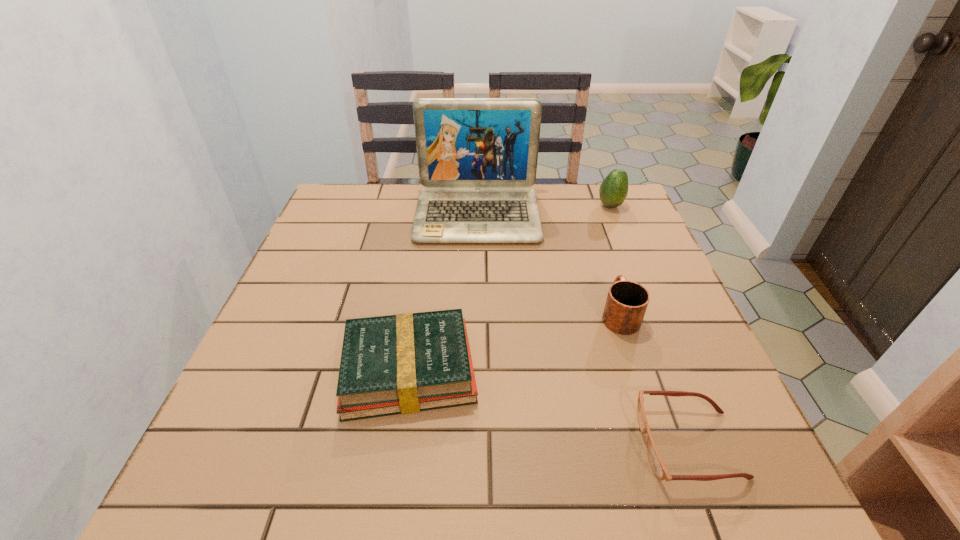
Image resolution: width=960 pixels, height=540 pixels. Find the location of `object at the far right corner`. object at the far right corner is located at coordinates (613, 191).

Locate an element on the screen. The height and width of the screenshot is (540, 960). object that is at the near right corner is located at coordinates (658, 466).

In the image, there is a desktop. At what (x,y) coordinates should I click in order to perform the action: click on blank space at the near edge. Please return your answer as a coordinate pair (x, y). Looking at the image, I should click on pyautogui.click(x=659, y=489).

The width and height of the screenshot is (960, 540). I want to click on vacant space at the left edge of the desktop, so click(329, 259).

You are a GUI agent. You are given a task and a screenshot of the screen. Output one action in this format:
    pyautogui.click(x=<x>, y=<y>)
    Task: Click on the free space at the right edge of the desktop
    Image resolution: width=960 pixels, height=540 pixels.
    Given the screenshot: What is the action you would take?
    pyautogui.click(x=649, y=329)

Locate an element on the screen. vacant space at the far right corner of the desktop is located at coordinates (596, 206).

Identify the location of free space at the near right corner of the desktop. This screenshot has width=960, height=540. (764, 487).

Where is `free space that is in between the shortest object and the avocado`? The width and height of the screenshot is (960, 540). free space that is in between the shortest object and the avocado is located at coordinates (650, 325).

In order to click on free space between the mug and the spectacles in this screenshot , I will do `click(654, 379)`.

Identify the location of blank region between the fourth tallest object and the shortest object. (549, 407).